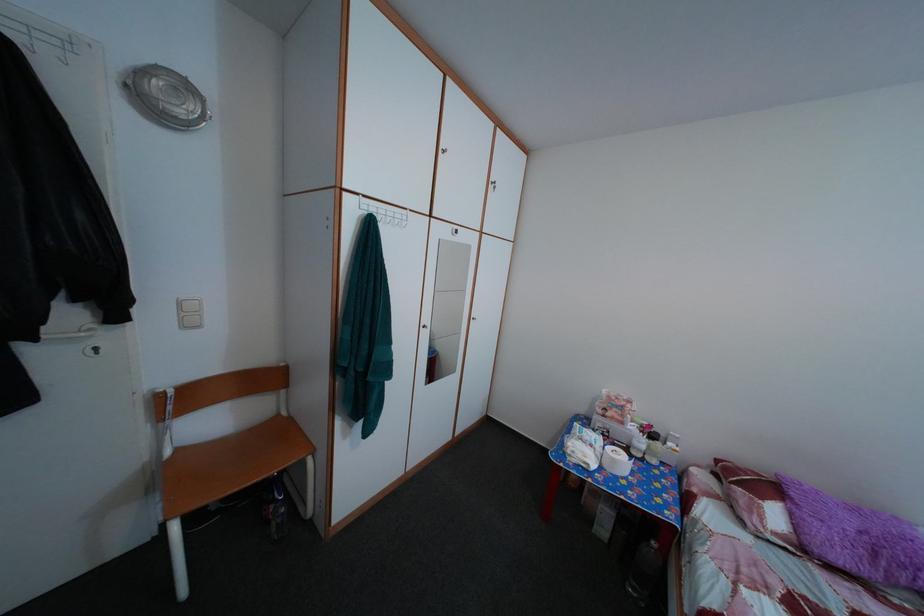
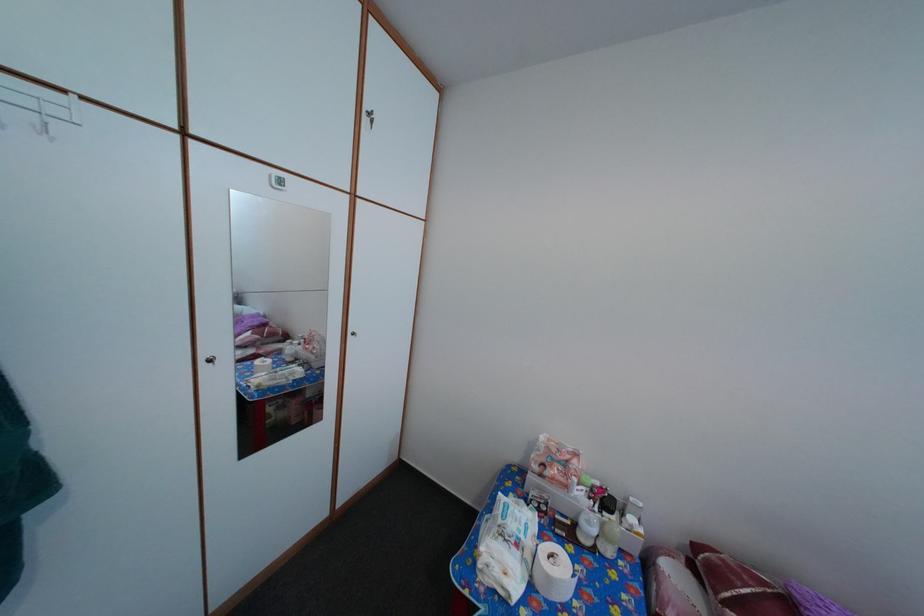
In the second image, find the point that corresponds to the point at 574,461 in the first image.

(484, 572)